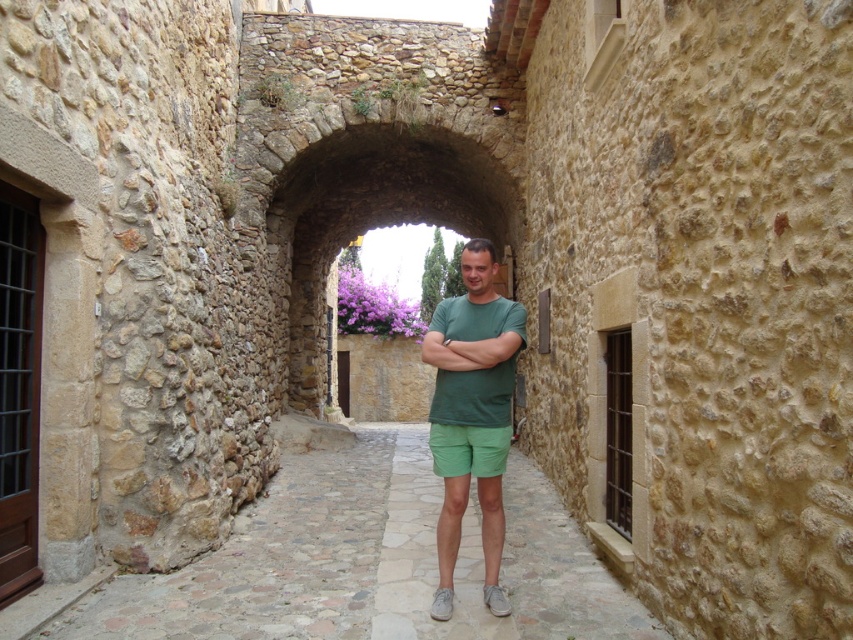
Question: Does green cotton t-shirt at center appear under green matte t-shirt at center?

Choices:
 (A) yes
 (B) no

Answer: (A)

Question: Does smooth stone alley at center lie behind green cotton t-shirt at center?

Choices:
 (A) no
 (B) yes

Answer: (B)

Question: Which object is the closest to the green cotton t-shirt at center?

Choices:
 (A) smooth stone alley at center
 (B) green matte t-shirt at center

Answer: (B)

Question: Which of these objects is positioned closest to the green cotton t-shirt at center?

Choices:
 (A) green matte t-shirt at center
 (B) smooth stone alley at center

Answer: (A)

Question: Which point appears closest to the camera in this image?

Choices:
 (A) (462, 356)
 (B) (280, 232)

Answer: (A)

Question: Can you confirm if smooth stone alley at center is positioned below green matte t-shirt at center?

Choices:
 (A) yes
 (B) no

Answer: (A)